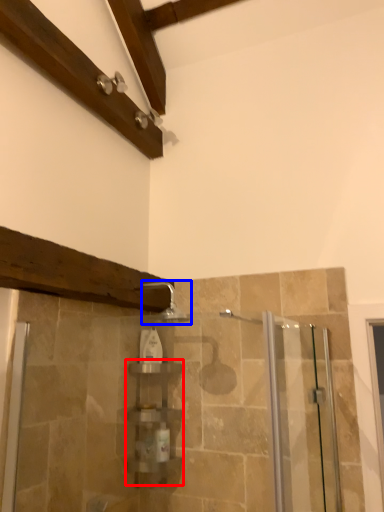
Question: Which point is closer to the camera, shelf (highlighted by a red box) or shower (highlighted by a blue box)?

Choices:
 (A) shelf
 (B) shower

Answer: (B)